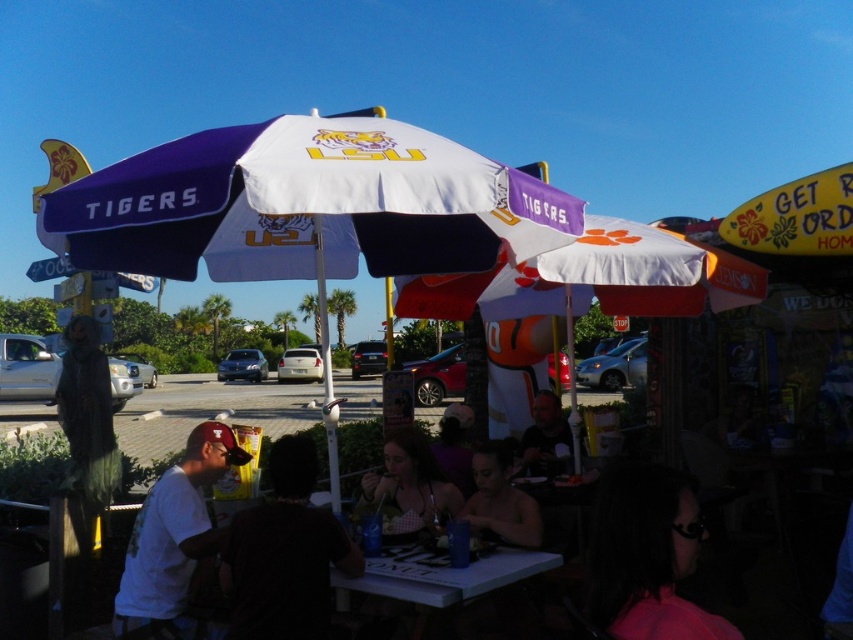
Is point (265, 236) positioned before point (534, 424)?

That is True.

Can you confirm if purple fabric umbrella at center is smaller than matte black shirt at center?

Actually, purple fabric umbrella at center might be larger than matte black shirt at center.

Does point (248, 138) lie in front of point (550, 390)?

Yes, it is.

The image size is (853, 640). In order to click on purple fabric umbrella at center in this screenshot , I will do `click(305, 204)`.

Based on the photo, can you confirm if white matte umbrella at center is taller than white matte t-shirt at lower left?

In fact, white matte umbrella at center may be shorter than white matte t-shirt at lower left.

Between white matte umbrella at center and white matte t-shirt at lower left, which one is positioned lower?

Positioned lower is white matte t-shirt at lower left.

Does point (679, 259) come farther from viewer compared to point (158, 602)?

Yes, it is.

This screenshot has height=640, width=853. Identify the location of white matte umbrella at center. (593, 280).

Is white matte umbrella at center wider than dark fabric shirt at center?

Correct, the width of white matte umbrella at center exceeds that of dark fabric shirt at center.

Can you confirm if white matte umbrella at center is positioned to the left of dark fabric shirt at center?

No, white matte umbrella at center is not to the left of dark fabric shirt at center.

Which is behind, point (608, 284) or point (276, 611)?

The point (608, 284) is more distant.

Find the location of a particular element. The height and width of the screenshot is (640, 853). white matte umbrella at center is located at coordinates (593, 280).